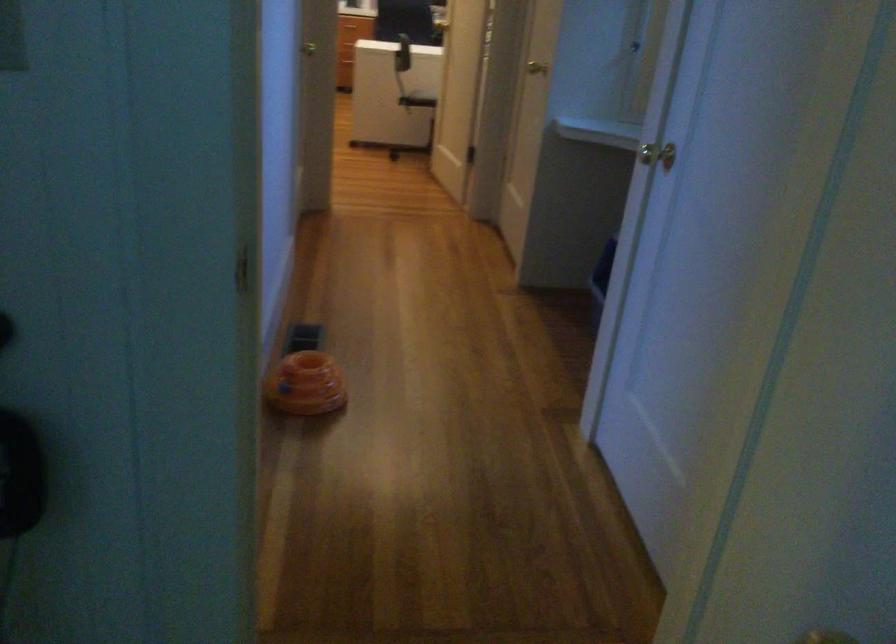
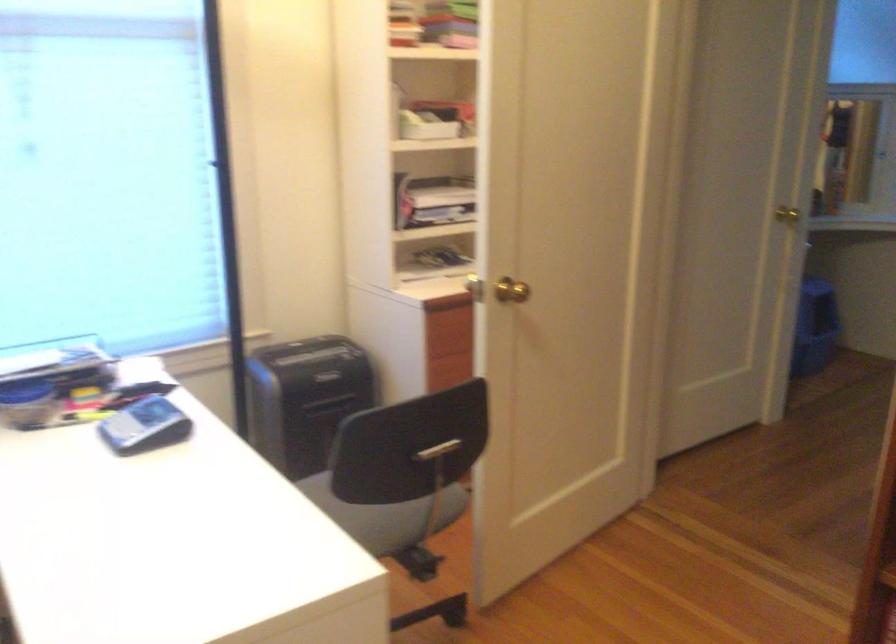
Locate, in the second image, the point that corresponds to the point at 424,90 in the first image.

(383, 515)